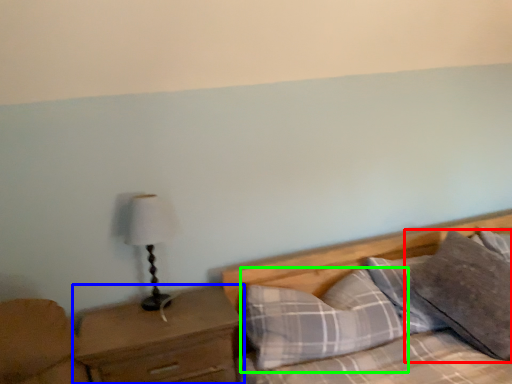
Question: Based on their relative distances, which object is farther from pillow (highlighted by a red box)? Choose from nightstand (highlighted by a blue box) and pillow (highlighted by a green box).

Choices:
 (A) nightstand
 (B) pillow

Answer: (A)